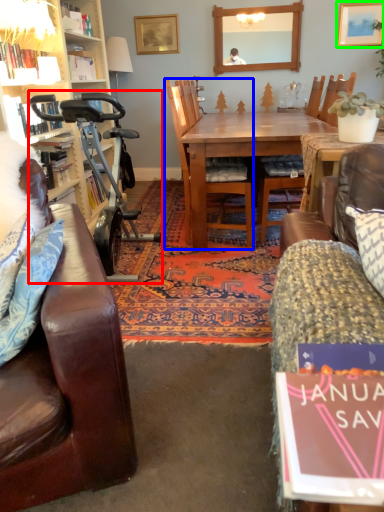
Question: Which object is positioned farthest from mobility scooter (highlighted by a red box)? Select from chair (highlighted by a blue box) and picture frame (highlighted by a green box).

Choices:
 (A) chair
 (B) picture frame

Answer: (B)